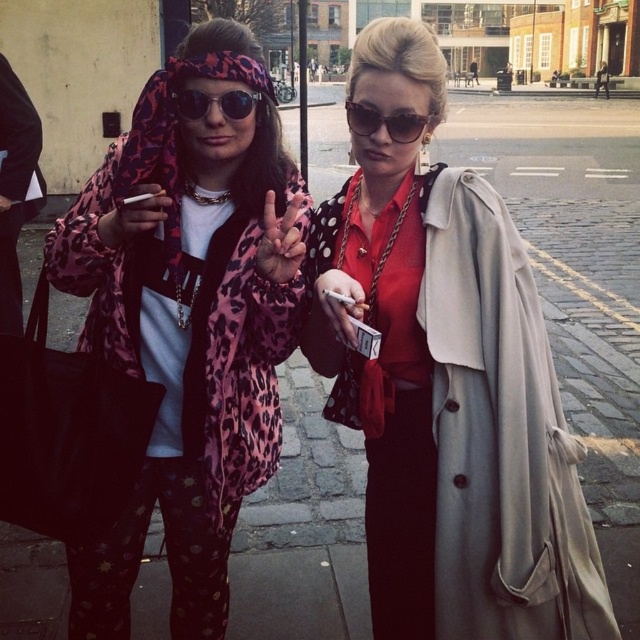
Question: Is light beige fabric trench coat at center thinner than leopard print sunglasses at center?

Choices:
 (A) yes
 (B) no

Answer: (B)

Question: Which object is the farthest from the pink leopard print hand at center?

Choices:
 (A) matte pink leopard print hand at left
 (B) pink leopard print scarf at left
 (C) matte beige trench coat at center
 (D) matte black cigarette at center

Answer: (C)

Question: Is pink leopard print scarf at left positioned at the back of leopard print sunglasses at center?

Choices:
 (A) no
 (B) yes

Answer: (A)

Question: Estimate the real-world distances between objects in this image. Which object is closer to the pink leopard print scarf at left?

Choices:
 (A) matte pink leopard print hand at left
 (B) light beige fabric trench coat at center
 (C) sunglasses at upper center
 (D) pink leopard print hand at center

Answer: (A)

Question: Is pink leopard print scarf at left closer to the viewer compared to pink leopard print hand at center?

Choices:
 (A) yes
 (B) no

Answer: (B)

Question: Which of the following is the farthest from the observer?

Choices:
 (A) (232, 92)
 (B) (477, 632)
 (C) (260, 237)
 (D) (541, 352)

Answer: (C)